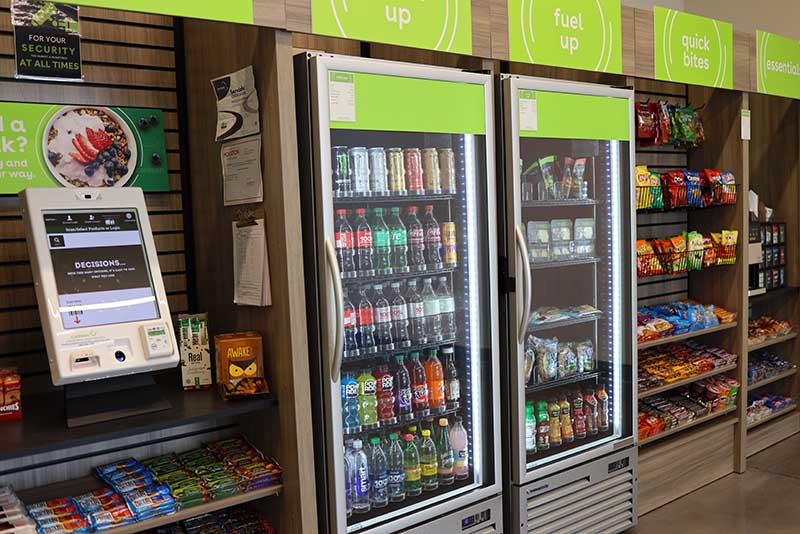
Image resolution: width=800 pixels, height=534 pixels. What are the coordinates of `papers` in the screenshot? It's located at (257, 277), (244, 184), (237, 98).